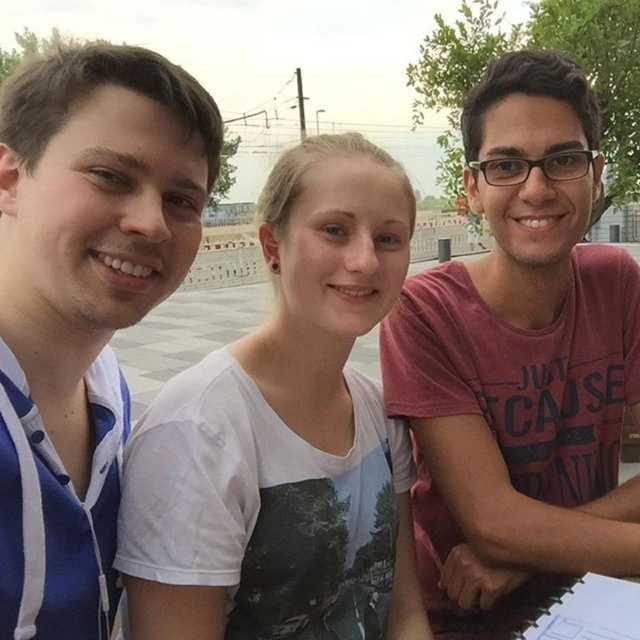
You are trying to decide which of the two shirts, the pink cotton shirt at right or the blue striped shirt at left, would be more suitable for a casual summer day. Based on their sizes, which one might be more comfortable for someone who prefers looser clothing?

The pink cotton shirt at right has a larger width than the blue striped shirt at left, making it a better choice for someone who prefers looser clothing as it offers more comfort and space.